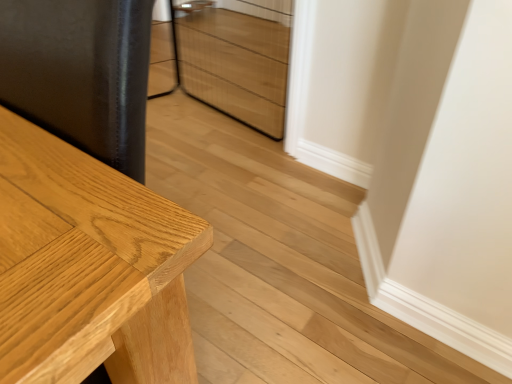
This screenshot has width=512, height=384. I want to click on free spot to the left of wooden drawer at center, so click(184, 119).